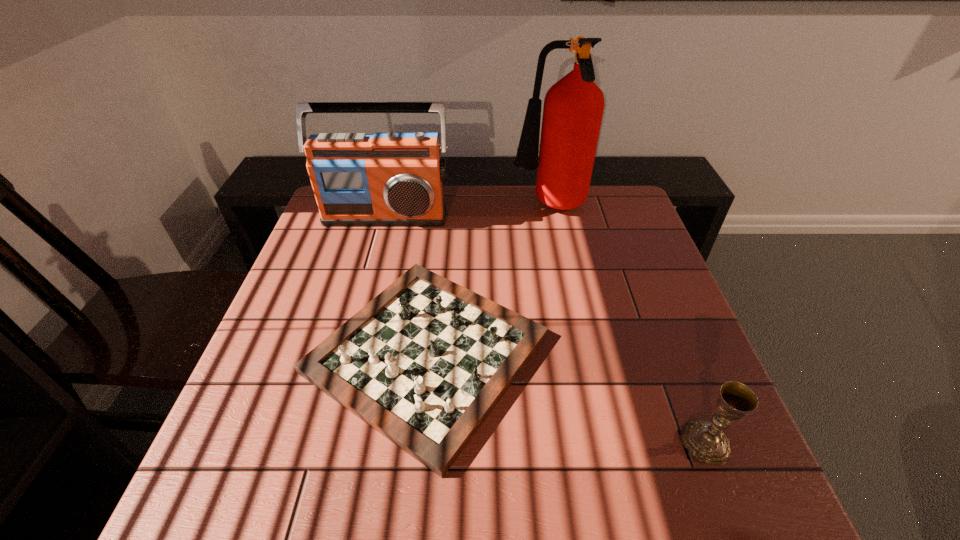
Identify the location of empty location between the chessboard and the fire extinguisher. (489, 281).

Where is `vacant space that's between the radio receiver and the tallest object`? The image size is (960, 540). vacant space that's between the radio receiver and the tallest object is located at coordinates (468, 212).

The height and width of the screenshot is (540, 960). I want to click on vacant space that's between the shortest object and the chalice, so click(566, 398).

What are the coordinates of `object that is the second closest to the chessboard` in the screenshot? It's located at (573, 108).

The image size is (960, 540). I want to click on object that is the nearest to the shortest object, so coord(383,179).

In order to click on free location that satisfies the following two spatial constraints: 1. at the nozzle of the fire extinguisher; 2. on the front side of the chessboard in this screenshot , I will do `click(580, 354)`.

Where is `free region that satisfies the following two spatial constraints: 1. on the front-facing side of the radio receiver; 2. on the right side of the chalice`? Image resolution: width=960 pixels, height=540 pixels. free region that satisfies the following two spatial constraints: 1. on the front-facing side of the radio receiver; 2. on the right side of the chalice is located at coordinates (324, 442).

At what (x,y) coordinates should I click in order to perform the action: click on vacant space that satisfies the following two spatial constraints: 1. at the nozzle of the tallest object; 2. on the front-facing side of the radio receiver. Please return your answer as a coordinate pair (x, y). Image resolution: width=960 pixels, height=540 pixels. Looking at the image, I should click on (551, 216).

Where is `free space that satisfies the following two spatial constraints: 1. at the nozzle of the tallest object; 2. on the front-facing side of the radio receiver`? Image resolution: width=960 pixels, height=540 pixels. free space that satisfies the following two spatial constraints: 1. at the nozzle of the tallest object; 2. on the front-facing side of the radio receiver is located at coordinates (551, 216).

The width and height of the screenshot is (960, 540). I want to click on free space that satisfies the following two spatial constraints: 1. at the nozzle of the fire extinguisher; 2. on the left side of the second shortest object, so click(597, 442).